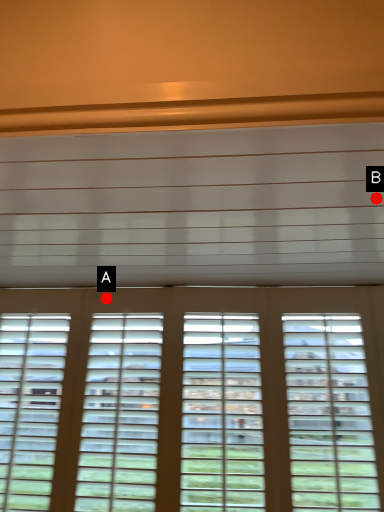
Question: Two points are circled on the image, labeled by A and B beside each circle. Which point appears farthest from the camera in this image?

Choices:
 (A) A is further
 (B) B is further

Answer: (A)